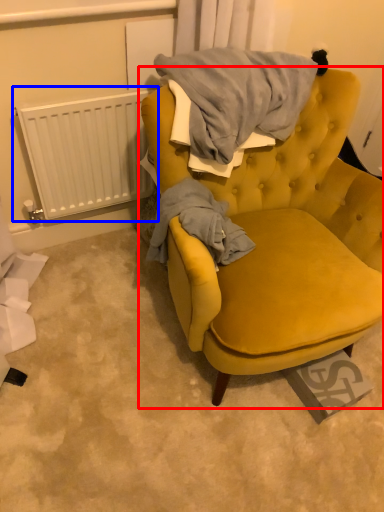
Question: Which object is closer to the camera taking this photo, chair (highlighted by a red box) or radiator (highlighted by a blue box)?

Choices:
 (A) chair
 (B) radiator

Answer: (A)